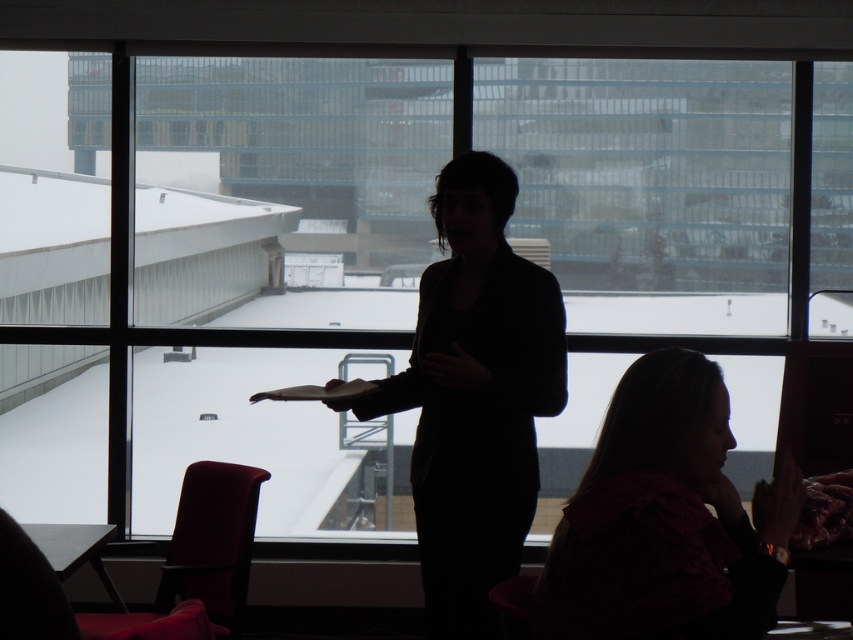
You are organizing a photo shoot and need to know the relative sizes of the clothing items in the scene. Which clothing item is wider between the black matte jacket at center and the matte pink blouse at lower right?

The black matte jacket at center is wider than the matte pink blouse at lower right as its width surpasses the blouse.

You are organizing a photoshoot and need to arrange the black matte jacket at center and the matte pink blouse at lower right in a way that maintains their height relationship. If you want to place the taller item closer to the camera, which item should be positioned nearer?

The black matte jacket at center is taller than the matte pink blouse at lower right, so to maintain their height relationship while placing the taller item closer to the camera, you should position the black matte jacket at center nearer.

Consider the image. You are a presenter standing in front of the room. You need to move from your current position to the door located at point [738,604]. There is an obstacle at point [556,333]. Can you safely walk around the obstacle to reach the door without getting too close?

Point [556,333] is behind point [738,604], so the obstacle is behind the door. Therefore, you can safely walk towards the door at [738,604] without needing to go around the obstacle since it is not in your path.